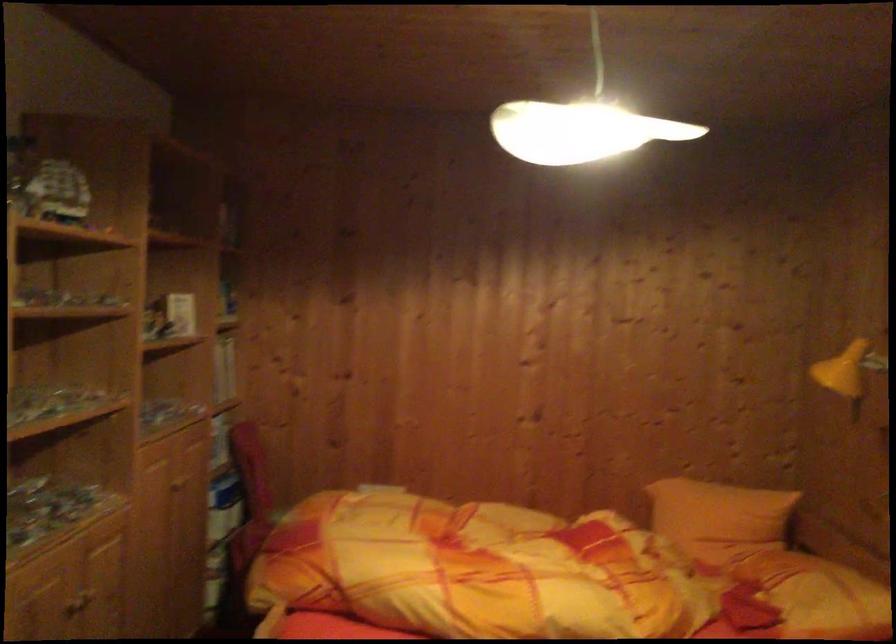
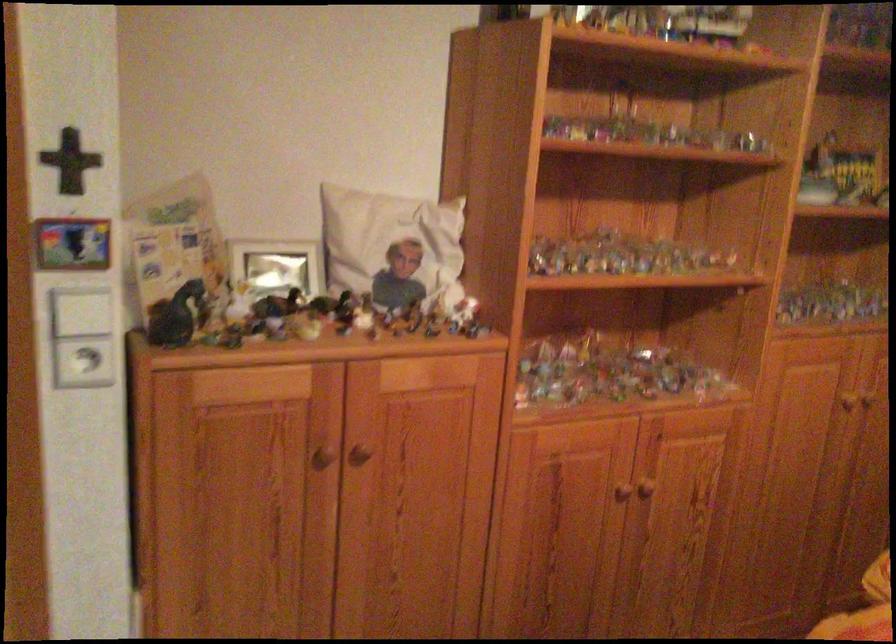
Question: The camera is either moving clockwise (left) or counter-clockwise (right) around the object. The first image is from the beginning of the video and the second image is from the end. Is the camera moving left or right when shooting the video?

Choices:
 (A) Left
 (B) Right

Answer: (B)